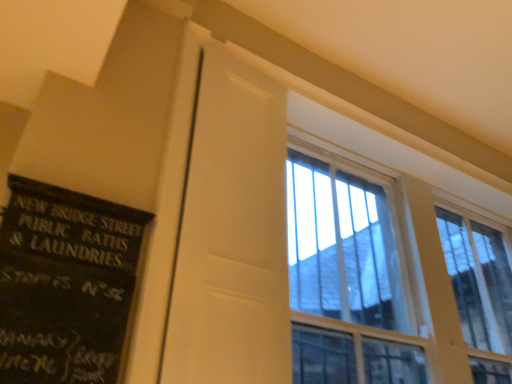
Question: Is white matte door at center aimed at black painted wood signboard at left?

Choices:
 (A) yes
 (B) no

Answer: (B)

Question: Is black painted wood signboard at left inside white matte door at center?

Choices:
 (A) yes
 (B) no

Answer: (B)

Question: Is white matte door at center next to black painted wood signboard at left?

Choices:
 (A) no
 (B) yes

Answer: (A)

Question: From the image's perspective, would you say white matte door at center is shown under black painted wood signboard at left?

Choices:
 (A) yes
 (B) no

Answer: (B)

Question: Is white matte door at center further to camera compared to black painted wood signboard at left?

Choices:
 (A) no
 (B) yes

Answer: (B)

Question: From a real-world perspective, is white matte door at center physically located above or below clear glass window at upper right?

Choices:
 (A) below
 (B) above

Answer: (A)

Question: Considering the relative positions of white matte door at center and clear glass window at upper right in the image provided, is white matte door at center to the left or to the right of clear glass window at upper right?

Choices:
 (A) right
 (B) left

Answer: (B)

Question: In the image, is white matte door at center positioned in front of or behind clear glass window at upper right?

Choices:
 (A) behind
 (B) front

Answer: (B)

Question: From the image's perspective, is white matte door at center located above or below clear glass window at upper right?

Choices:
 (A) above
 (B) below

Answer: (A)

Question: Is clear glass window at upper right spatially inside white matte door at center, or outside of it?

Choices:
 (A) inside
 (B) outside

Answer: (B)

Question: Does point (344, 314) appear closer or farther from the camera than point (217, 297)?

Choices:
 (A) farther
 (B) closer

Answer: (A)

Question: From a real-world perspective, relative to white matte door at center, is clear glass window at upper right vertically above or below?

Choices:
 (A) above
 (B) below

Answer: (A)

Question: In terms of height, does clear glass window at upper right look taller or shorter compared to white matte door at center?

Choices:
 (A) short
 (B) tall

Answer: (A)

Question: Is black painted wood signboard at left in front of or behind white matte door at center in the image?

Choices:
 (A) behind
 (B) front

Answer: (B)

Question: Based on their positions, is black painted wood signboard at left located to the left or right of white matte door at center?

Choices:
 (A) left
 (B) right

Answer: (A)